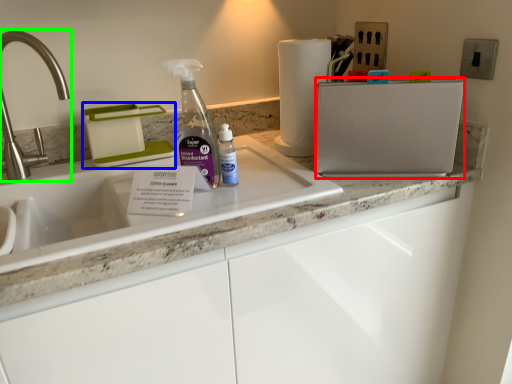
Question: Based on their relative distances, which object is nearer to appliance (highlighted by a red box)? Choose from appliance (highlighted by a blue box) and tap (highlighted by a green box).

Choices:
 (A) appliance
 (B) tap

Answer: (A)